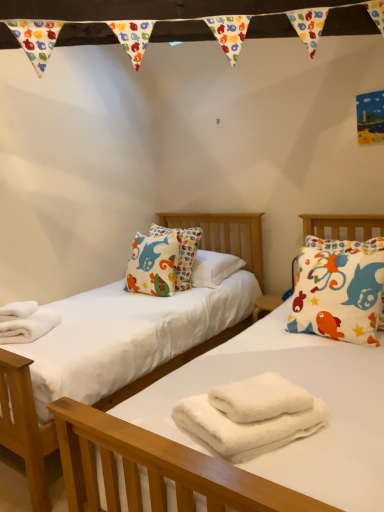
Question: Are white fluffy towels at lower left and white cotton pillow with colorful fish at right located far from each other?

Choices:
 (A) no
 (B) yes

Answer: (B)

Question: From the image's perspective, is white fluffy towels at lower left beneath white cotton pillow with colorful fish at right?

Choices:
 (A) yes
 (B) no

Answer: (A)

Question: From a real-world perspective, is white fluffy towels at lower left positioned under white cotton pillow with colorful fish at right based on gravity?

Choices:
 (A) no
 (B) yes

Answer: (B)

Question: From the image's perspective, is white fluffy towels at lower left over white cotton pillow with colorful fish at right?

Choices:
 (A) yes
 (B) no

Answer: (B)

Question: Considering the relative sizes of white fluffy towels at lower left and white cotton pillow with colorful fish at right in the image provided, is white fluffy towels at lower left bigger than white cotton pillow with colorful fish at right?

Choices:
 (A) yes
 (B) no

Answer: (B)

Question: From a real-world perspective, is white fluffy towels at lower left on white cotton pillow with colorful fish at right?

Choices:
 (A) yes
 (B) no

Answer: (B)

Question: From a real-world perspective, is white fluffy towels at center, the second bath towel when ordered from top to bottom, beneath white fluffy bath towel at center, marked as the second bath towel in a bottom-to-top arrangement?

Choices:
 (A) yes
 (B) no

Answer: (A)

Question: Does white fluffy towels at center, the second bath towel when ordered from top to bottom, have a lesser height compared to white fluffy bath towel at center, the first bath towel when ordered from top to bottom?

Choices:
 (A) no
 (B) yes

Answer: (A)

Question: Is white fluffy towels at center, which is the 1th bath towel in bottom-to-top order, not within white fluffy bath towel at center, the first bath towel when ordered from top to bottom?

Choices:
 (A) yes
 (B) no

Answer: (A)

Question: From the image's perspective, is white fluffy towels at center, which is the 1th bath towel in bottom-to-top order, below white fluffy bath towel at center, marked as the second bath towel in a bottom-to-top arrangement?

Choices:
 (A) yes
 (B) no

Answer: (A)

Question: Can you confirm if white fluffy towels at center, which is the 1th bath towel in bottom-to-top order, is taller than white fluffy bath towel at center, marked as the second bath towel in a bottom-to-top arrangement?

Choices:
 (A) no
 (B) yes

Answer: (B)

Question: Does white fluffy towels at center, which is the 1th bath towel in bottom-to-top order, have a lesser width compared to white fluffy bath towel at center, the first bath towel when ordered from top to bottom?

Choices:
 (A) no
 (B) yes

Answer: (A)

Question: Does white fluffy bath towel at center, marked as the second bath towel in a bottom-to-top arrangement, lie in front of white fluffy towels at center, the second bath towel when ordered from top to bottom?

Choices:
 (A) yes
 (B) no

Answer: (B)